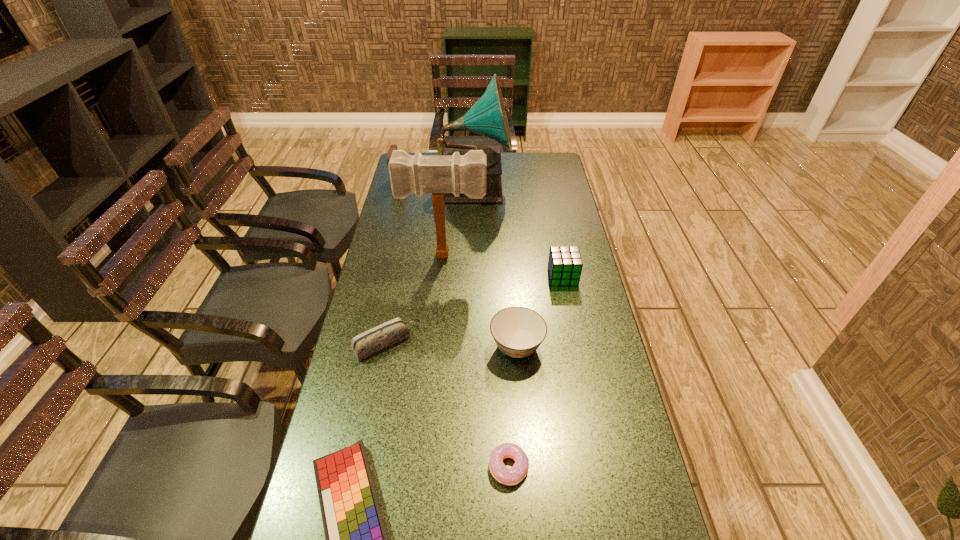
Locate an element on the screen. free spot between the doughnut and the sixth shortest object is located at coordinates (454, 325).

You are a GUI agent. You are given a task and a screenshot of the screen. Output one action in this format:
    pyautogui.click(x=<x>, y=<y>)
    Task: Click on the free area in between the doughnut and the pencil box
    
    Given the screenshot: What is the action you would take?
    pyautogui.click(x=447, y=405)

Identify the location of the sixth closest object to the pouch. (356, 539).

I want to click on object that is the seventh closest one to the soup bowl, so click(393, 147).

I want to click on vacant space that satisfies the following two spatial constraints: 1. on the horn of the tallest object; 2. on the front side of the third shortest object, so click(472, 342).

Where is `vacant space that satisfies the following two spatial constraints: 1. on the front side of the third shortest object; 2. on the left side of the doughnut`? The image size is (960, 540). vacant space that satisfies the following two spatial constraints: 1. on the front side of the third shortest object; 2. on the left side of the doughnut is located at coordinates (362, 467).

The height and width of the screenshot is (540, 960). Find the location of `blank area in the image that satisfies the following two spatial constraints: 1. with an open flap on the sixth shortest object; 2. on the right side of the third shortest object`. blank area in the image that satisfies the following two spatial constraints: 1. with an open flap on the sixth shortest object; 2. on the right side of the third shortest object is located at coordinates (358, 342).

Identify the location of free spot that satisfies the following two spatial constraints: 1. on the back side of the pencil box; 2. with an open flap on the third tallest object. click(418, 184).